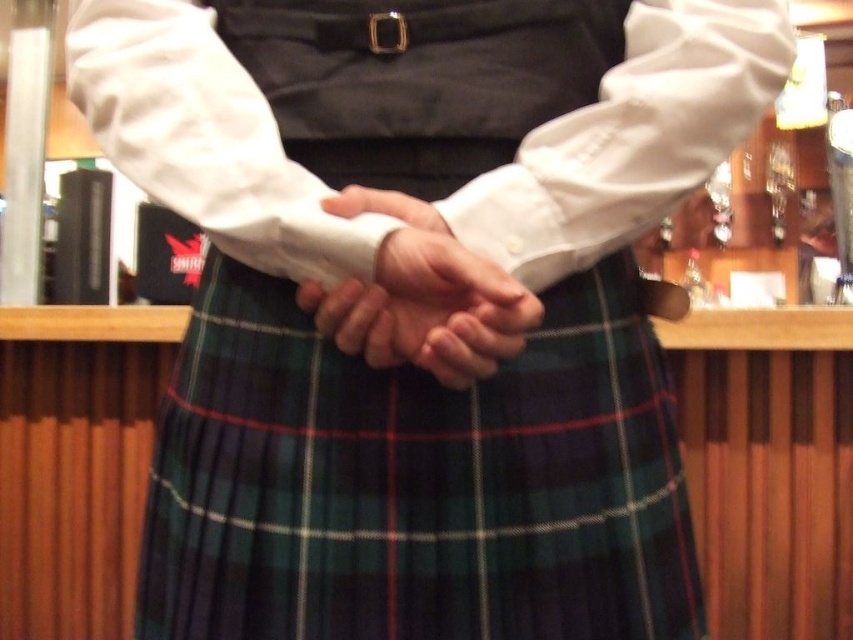
Question: Observing the image, what is the correct spatial positioning of green plaid kilt at center in reference to white matte shirt at center?

Choices:
 (A) below
 (B) above

Answer: (A)

Question: Observing the image, what is the correct spatial positioning of green plaid kilt at center in reference to white matte shirt at center?

Choices:
 (A) right
 (B) left

Answer: (B)

Question: Which object is closer to the camera taking this photo?

Choices:
 (A) white smooth shirt at center
 (B) green plaid kilt at center
 (C) white matte shirt at center

Answer: (C)

Question: Among these objects, which one is farthest from the camera?

Choices:
 (A) white matte shirt at center
 (B) green plaid kilt at center
 (C) white smooth shirt at center

Answer: (B)

Question: Which of the following is the closest to the observer?

Choices:
 (A) (440, 257)
 (B) (556, 433)
 (C) (624, 232)

Answer: (A)

Question: Does green plaid kilt at center appear on the left side of white smooth shirt at center?

Choices:
 (A) no
 (B) yes

Answer: (B)